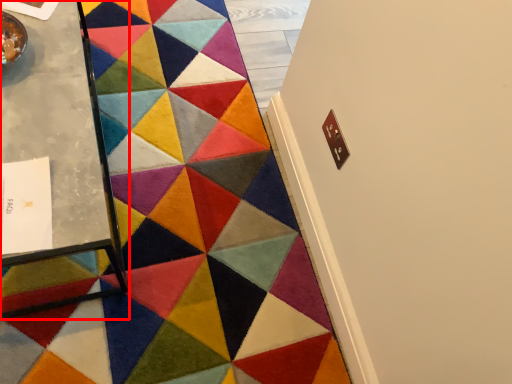
Question: From the image's perspective, where is table (annotated by the red box) located in relation to mat in the image?

Choices:
 (A) above
 (B) below

Answer: (A)